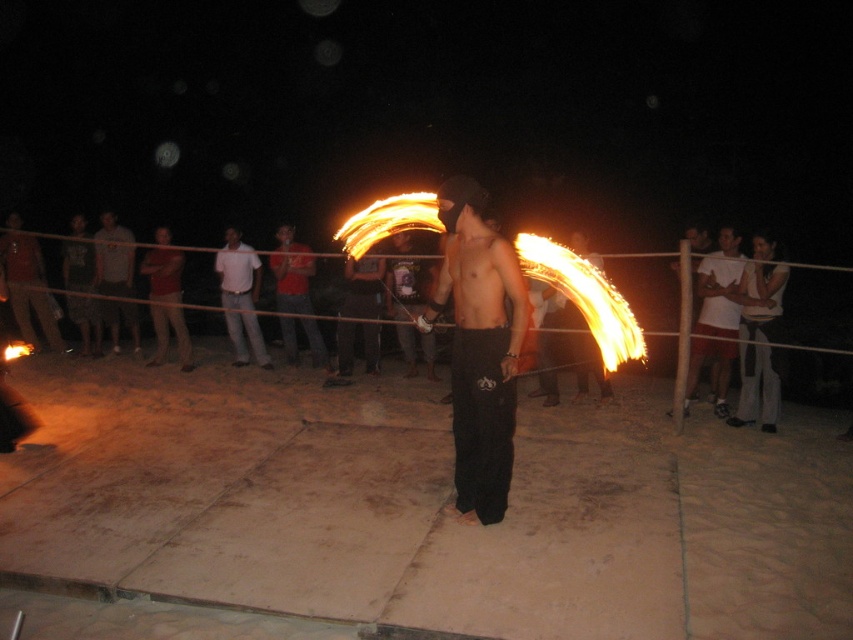
Question: Estimate the real-world distances between objects in this image. Which object is closer to the fluorescent yellow-orange flame at center?

Choices:
 (A) smooth white shirt at right
 (B) shiny metallic pants at center

Answer: (A)

Question: Is matte red shirt at left bigger than smooth white shirt at right?

Choices:
 (A) no
 (B) yes

Answer: (A)

Question: Which point is farther to the camera?

Choices:
 (A) red cotton shirt at center
 (B) fluorescent yellow-orange flame at center
 (C) matte red shirt at left

Answer: (C)

Question: Does matte red shirt at left have a larger size compared to shiny metallic pants at center?

Choices:
 (A) no
 (B) yes

Answer: (B)

Question: Does matte red shirt at left appear on the left side of red cotton shirt at center?

Choices:
 (A) no
 (B) yes

Answer: (B)

Question: Estimate the real-world distances between objects in this image. Which object is closer to the shiny metallic fire spinner at center?

Choices:
 (A) white cotton shirt at center
 (B) white cotton shirt at left

Answer: (A)